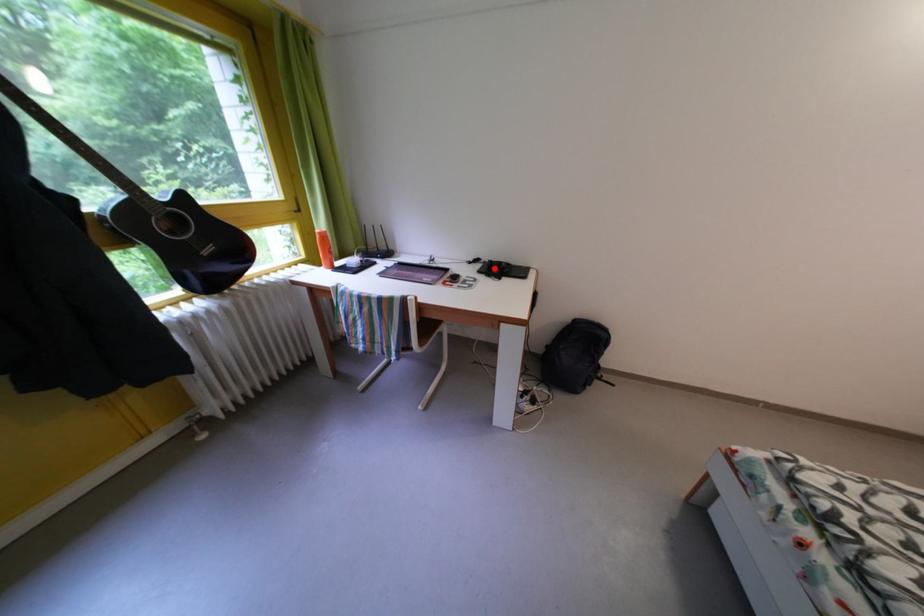
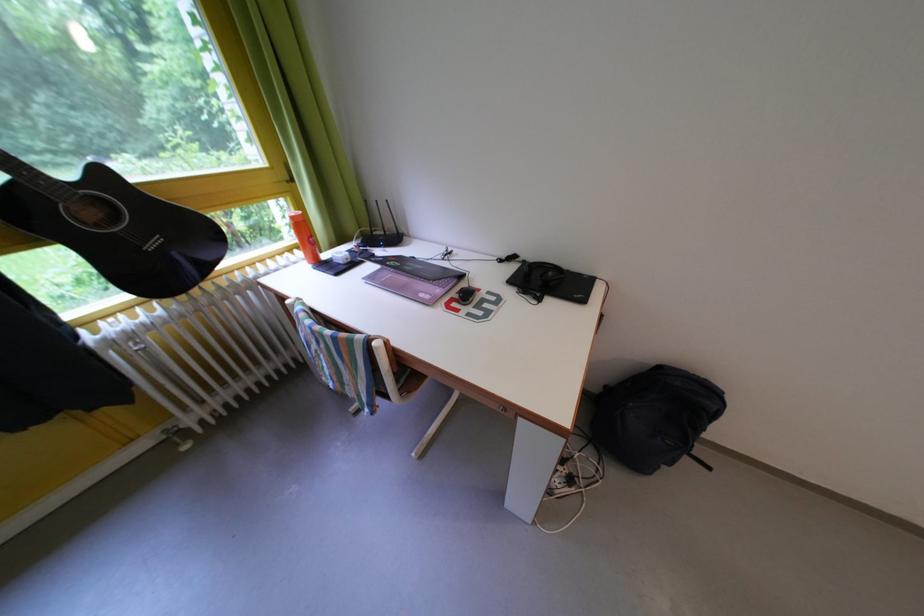
Question: I am providing you with two images of the same scene from different viewpoints. A red point is marked on the first image. Can you still see the location of the red point in image 2?

Choices:
 (A) Yes
 (B) No

Answer: (A)